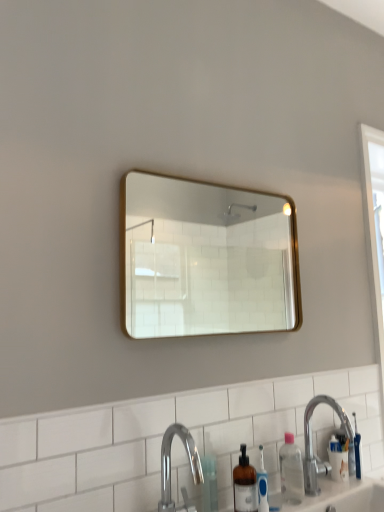
Question: Should I look upward or downward to see clear plastic bottle at lower right?

Choices:
 (A) up
 (B) down

Answer: (B)

Question: Can you confirm if translucent plastic bottle at lower center is wider than polished chrome faucet at lower center?

Choices:
 (A) no
 (B) yes

Answer: (A)

Question: Is there a large distance between translucent plastic bottle at lower center and polished chrome faucet at lower center?

Choices:
 (A) no
 (B) yes

Answer: (A)

Question: Is translucent plastic bottle at lower center not within polished chrome faucet at lower center?

Choices:
 (A) yes
 (B) no

Answer: (A)

Question: Is the depth of translucent plastic bottle at lower center less than that of polished chrome faucet at lower center?

Choices:
 (A) no
 (B) yes

Answer: (A)

Question: From the image's perspective, is translucent plastic bottle at lower center over polished chrome faucet at lower center?

Choices:
 (A) yes
 (B) no

Answer: (B)

Question: Are translucent plastic bottle at lower center and polished chrome faucet at lower center making contact?

Choices:
 (A) no
 (B) yes

Answer: (A)

Question: Is gold-framed mirror at upper center positioned beyond the bounds of white wood screen door at right?

Choices:
 (A) no
 (B) yes

Answer: (B)

Question: Are gold-framed mirror at upper center and white wood screen door at right far apart?

Choices:
 (A) no
 (B) yes

Answer: (B)

Question: Is gold-framed mirror at upper center thinner than white wood screen door at right?

Choices:
 (A) yes
 (B) no

Answer: (A)

Question: Can you confirm if gold-framed mirror at upper center is positioned to the right of white wood screen door at right?

Choices:
 (A) yes
 (B) no

Answer: (B)

Question: From the image's perspective, does gold-framed mirror at upper center appear higher than white wood screen door at right?

Choices:
 (A) yes
 (B) no

Answer: (A)

Question: Is gold-framed mirror at upper center taller than white wood screen door at right?

Choices:
 (A) no
 (B) yes

Answer: (A)

Question: From a real-world perspective, is silver metallic sink at lower right on top of translucent plastic bottle at lower center?

Choices:
 (A) yes
 (B) no

Answer: (A)